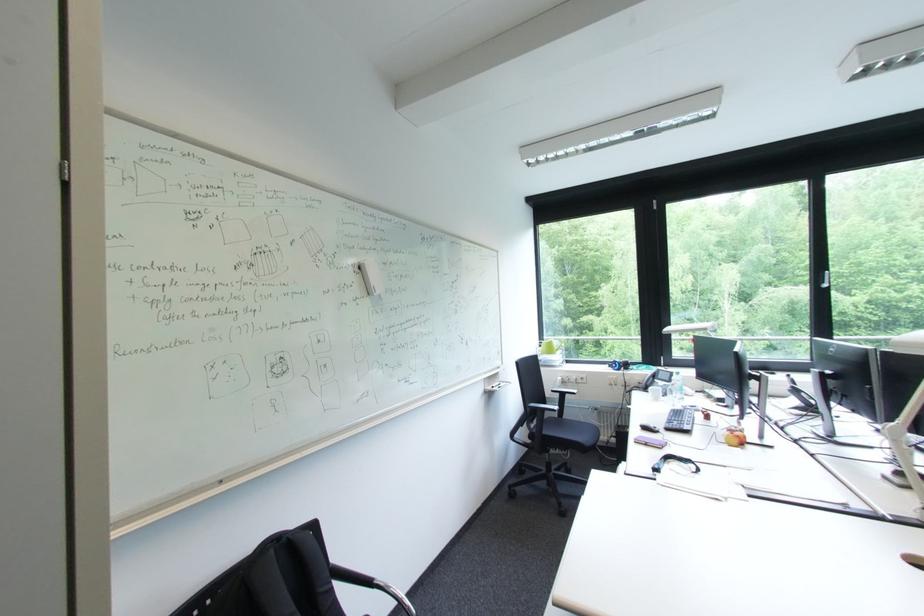
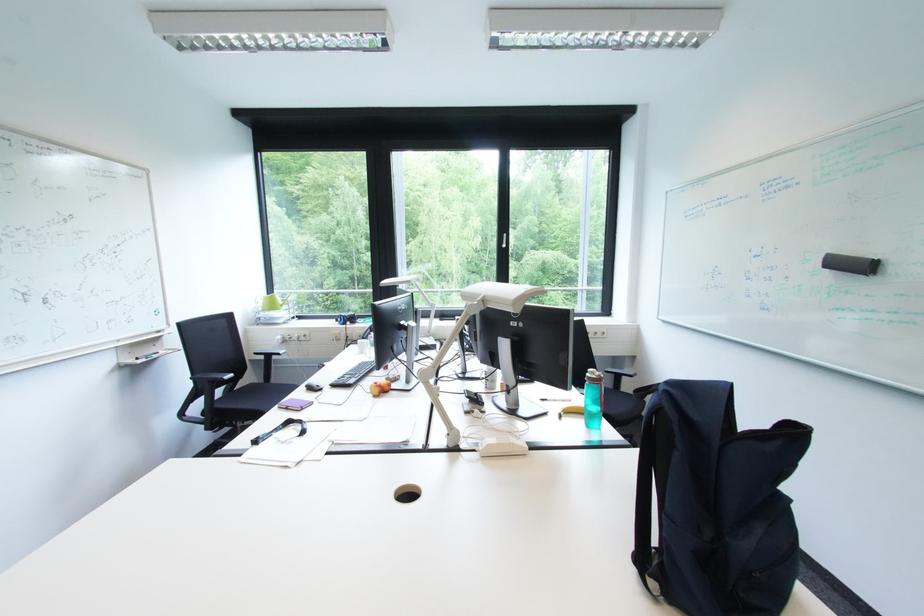
Find the pixel in the second image that matches [655,446] in the first image.

(297, 410)